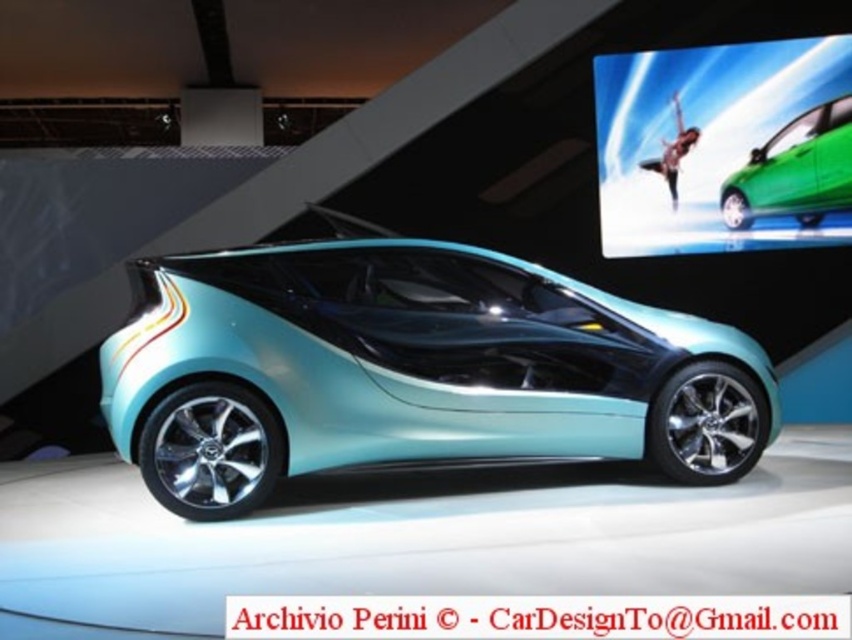
You are at an auto show and want to take a photo of both the metallic teal car at center and the green glossy car at center. Since you want to include both in the frame, which car should you position closer to the camera to ensure both fit in the photo?

You should position the metallic teal car at center closer to the camera because it is bigger than the green glossy car at center. This way, both cars will be visible in the photo without one being too small or the other too large.

You are a photographer at an auto show. You need to decide which car to photograph first based on their heights. The metallic teal car at center and the green glossy car at center are both in your view. Which one is taller?

The metallic teal car at center is much taller than the green glossy car at center, so you should photograph the metallic teal car at center first if height is your priority.